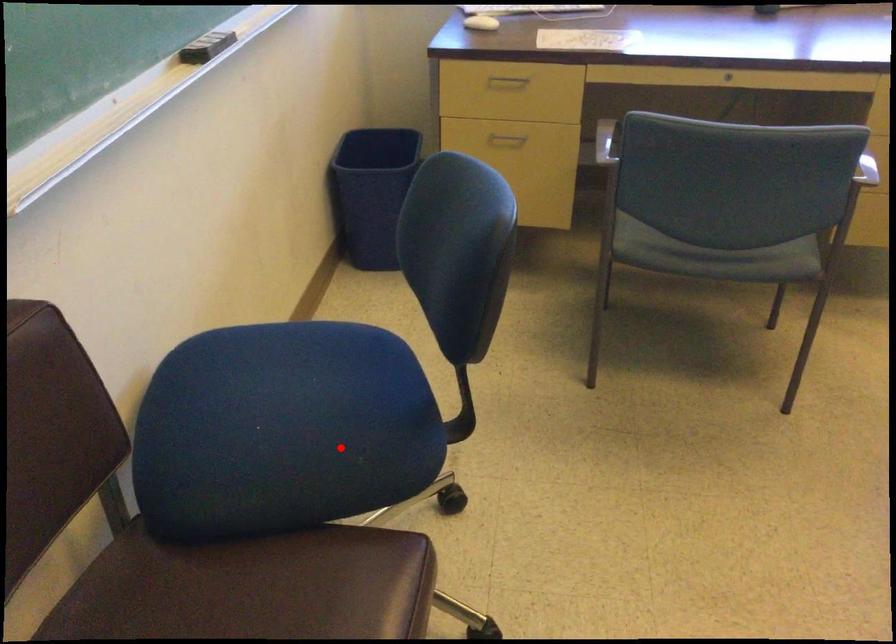
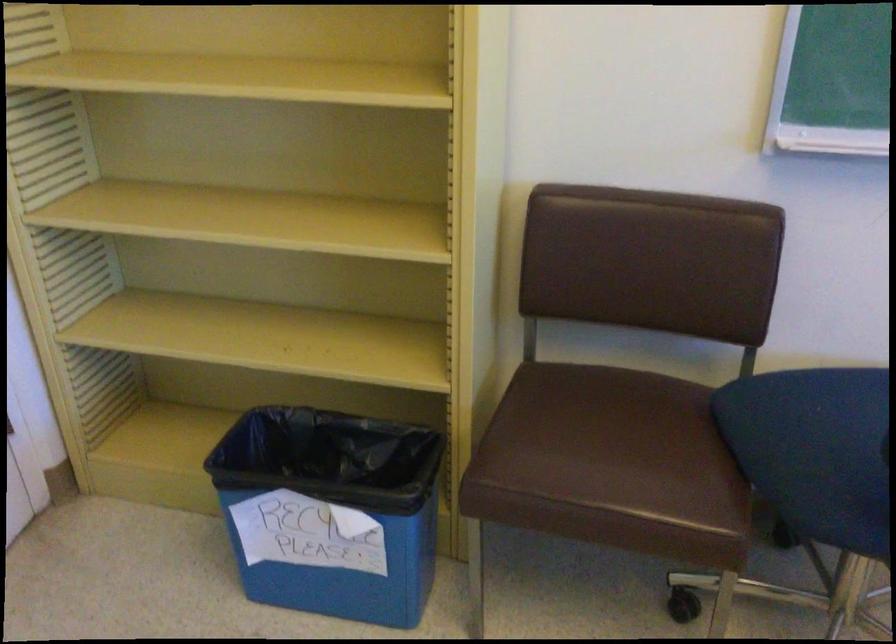
Where in the second image is the point corresponding to the highlighted location from the first image?

(814, 450)